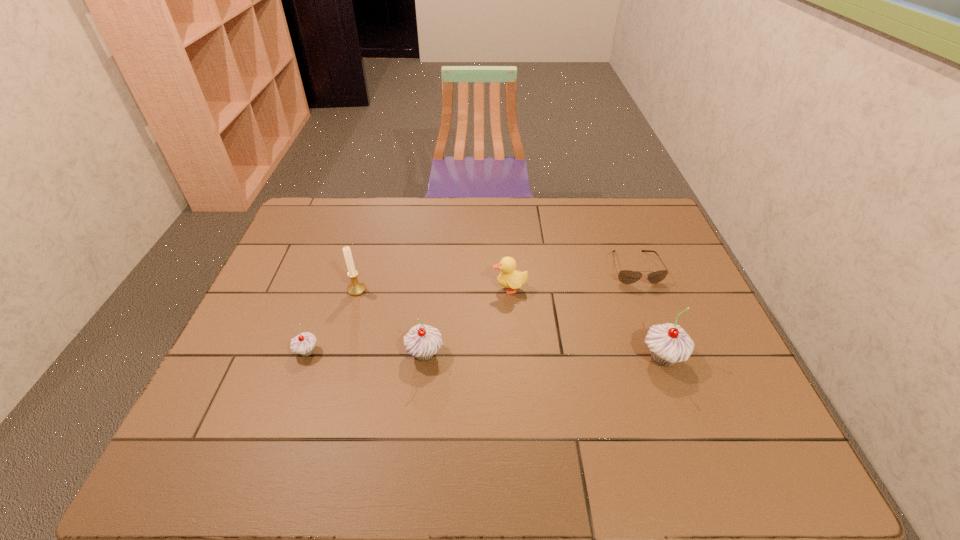
In the image, there is a desktop. Identify the location of vacant space at the near edge. (295, 419).

The image size is (960, 540). What are the coordinates of `vacant space at the left edge of the desktop` in the screenshot? It's located at (280, 376).

The image size is (960, 540). What are the coordinates of `vacant space at the right edge` in the screenshot? It's located at (659, 309).

The image size is (960, 540). In order to click on vacant space at the far right corner of the desktop in this screenshot , I will do `click(655, 207)`.

Locate an element on the screen. This screenshot has height=540, width=960. vacant space at the near right corner of the desktop is located at coordinates (690, 417).

Image resolution: width=960 pixels, height=540 pixels. What are the coordinates of `vacant space in between the shortest cupcake and the shortest object` in the screenshot? It's located at (470, 310).

Where is `empty location between the fourth object from left to right and the fifth object from right to left`? This screenshot has height=540, width=960. empty location between the fourth object from left to right and the fifth object from right to left is located at coordinates coord(433,289).

Where is `free spot between the sunglasses and the second shortest cupcake`? The image size is (960, 540). free spot between the sunglasses and the second shortest cupcake is located at coordinates (530, 311).

Locate an element on the screen. free space between the fourth object from right to left and the rightmost cupcake is located at coordinates click(543, 356).

At what (x,y) coordinates should I click in order to perform the action: click on free point between the fourth object from right to left and the rightmost cupcake. Please return your answer as a coordinate pair (x, y). Looking at the image, I should click on (543, 356).